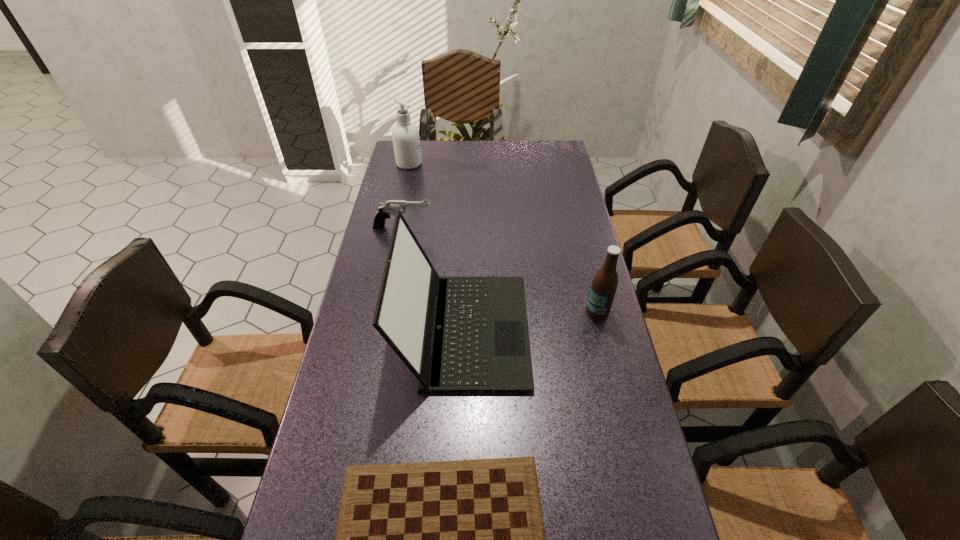
Find the location of a particular element. empty location between the second farthest object and the rightmost object is located at coordinates (500, 269).

Find the location of a particular element. Image resolution: width=960 pixels, height=540 pixels. vacant point located between the cleansing agent and the second farthest object is located at coordinates (406, 196).

Where is `unoccupied position between the laptop and the farthest object`? The width and height of the screenshot is (960, 540). unoccupied position between the laptop and the farthest object is located at coordinates (437, 247).

At what (x,y) coordinates should I click in order to perform the action: click on free space between the cleansing agent and the fourth nearest object. Please return your answer as a coordinate pair (x, y). Looking at the image, I should click on (406, 196).

This screenshot has width=960, height=540. What are the coordinates of `object identified as the third closest to the beer bottle` in the screenshot? It's located at (390, 207).

Choose which object is the third nearest neighbor to the nearest object. Please provide its 2D coordinates. Your answer should be formatted as a tuple, i.e. [(x, y)], where the tuple contains the x and y coordinates of a point satisfying the conditions above.

[(390, 207)]

Locate an element on the screen. The image size is (960, 540). free location that satisfies the following two spatial constraints: 1. on the front label of the beer bottle; 2. on the left side of the cleansing agent is located at coordinates (377, 311).

At what (x,y) coordinates should I click in order to perform the action: click on vacant area in the image that satisfies the following two spatial constraints: 1. on the front side of the beer bottle; 2. on the surface of the laptop. Please return your answer as a coordinate pair (x, y). Looking at the image, I should click on pos(602,330).

Where is `blank area in the image that satisfies the following two spatial constraints: 1. at the muzzle of the rightmost object; 2. on the right side of the fourth nearest object`? Image resolution: width=960 pixels, height=540 pixels. blank area in the image that satisfies the following two spatial constraints: 1. at the muzzle of the rightmost object; 2. on the right side of the fourth nearest object is located at coordinates (386, 311).

Locate an element on the screen. The image size is (960, 540). blank area in the image that satisfies the following two spatial constraints: 1. at the muzzle of the rightmost object; 2. on the right side of the gun is located at coordinates (386, 311).